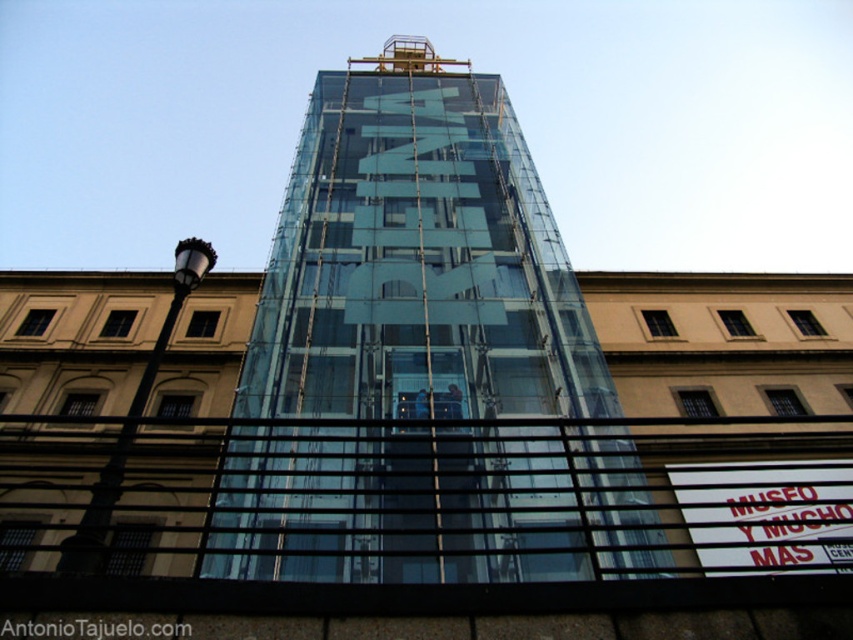
You are standing on the sidewalk and see the transparent glass tower at center and the white plastic sign at lower right. Which object is higher from the ground?

The transparent glass tower at center is located above the white plastic sign at lower right, so it is higher from the ground.

You are a delivery person who needs to place a new sign exactly 8 meters away from the transparent glass tower at center. You have the white plastic sign at lower right. Can you use it for this task?

The distance between the transparent glass tower at center and the white plastic sign at lower right is 7.99 meters, which is just 1 centimeter less than the required 8 meters. Therefore, the white plastic sign at lower right cannot be used as it is slightly closer than the specified distance.